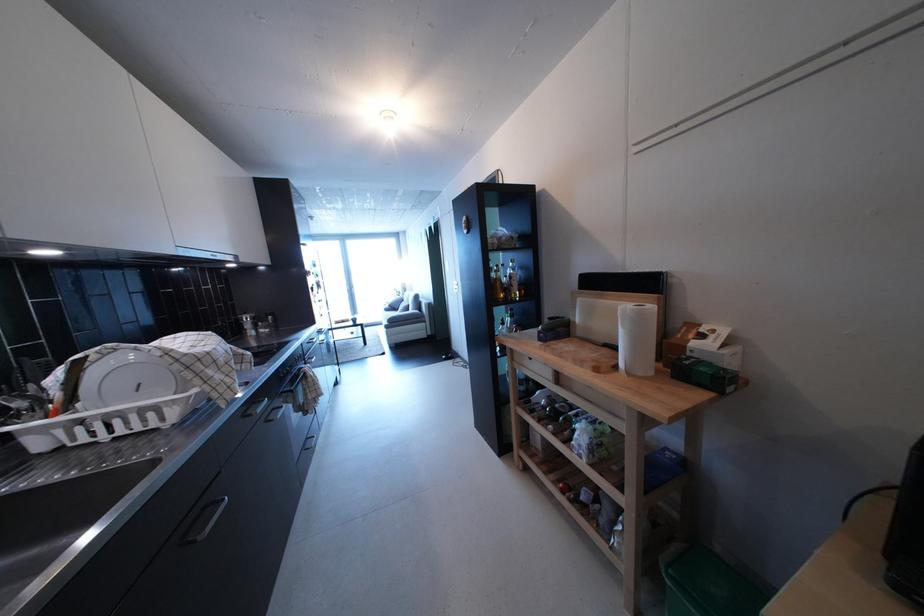
Where is `sofa armrest`? This screenshot has height=616, width=924. sofa armrest is located at coordinates (405, 318).